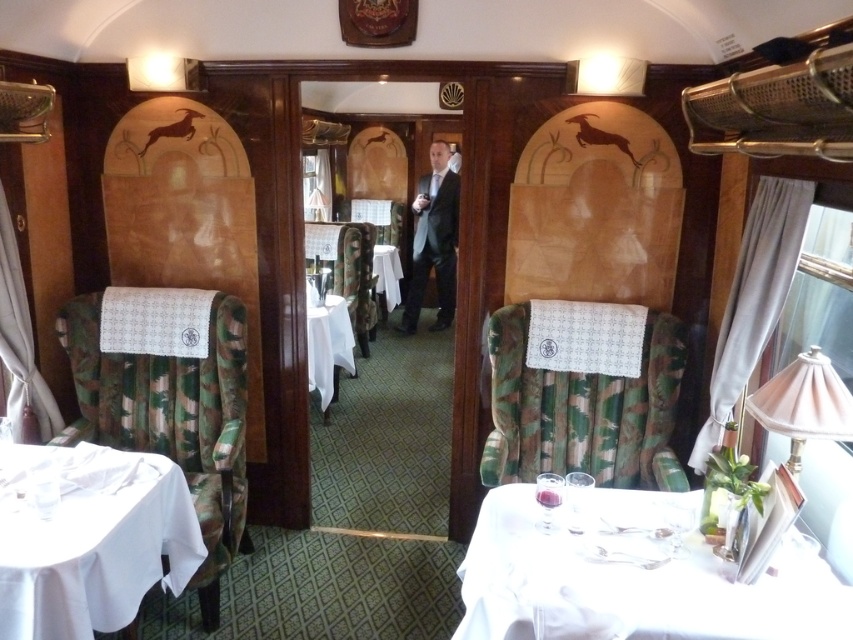
Question: Does dark gray suit at center have a greater width compared to white cloth at center?

Choices:
 (A) yes
 (B) no

Answer: (A)

Question: Is dark gray suit at center to the left of white cloth-covered table at center from the viewer's perspective?

Choices:
 (A) no
 (B) yes

Answer: (A)

Question: Estimate the real-world distances between objects in this image. Which object is farther from the white cloth-covered table at center?

Choices:
 (A) white cloth at lower right
 (B) white cloth table at lower left
 (C) dark gray suit at center

Answer: (A)

Question: Does white cloth-covered table at center appear on the right side of white cloth at center?

Choices:
 (A) no
 (B) yes

Answer: (A)

Question: Which of these objects is positioned closest to the dark gray suit at center?

Choices:
 (A) white cloth at lower right
 (B) white cloth-covered table at center
 (C) white cloth table at lower left
 (D) white cloth at center

Answer: (D)

Question: Considering the real-world distances, which object is farthest from the white cloth-covered table at center?

Choices:
 (A) white cloth at center
 (B) white cloth table at lower left
 (C) white cloth at lower right

Answer: (C)